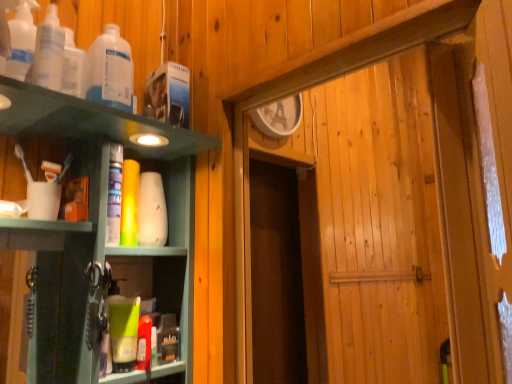
Question: Should I look upward or downward to see green matte tube at lower left, the 1th toiletry from the bottom?

Choices:
 (A) down
 (B) up

Answer: (A)

Question: From the image's perspective, is white matte cup at left on top of translucent plastic bottle at upper left, arranged as the 3th bottle when viewed from the front?

Choices:
 (A) yes
 (B) no

Answer: (B)

Question: Can you confirm if white matte cup at left is smaller than translucent plastic bottle at upper left, the 1th bottle positioned from the back?

Choices:
 (A) no
 (B) yes

Answer: (B)

Question: Can we say white matte cup at left lies outside translucent plastic bottle at upper left, arranged as the 3th bottle when viewed from the front?

Choices:
 (A) no
 (B) yes

Answer: (B)

Question: Does white matte cup at left turn towards translucent plastic bottle at upper left, the 1th bottle positioned from the back?

Choices:
 (A) no
 (B) yes

Answer: (A)

Question: Are white matte cup at left and translucent plastic bottle at upper left, the 1th bottle positioned from the back, located far from each other?

Choices:
 (A) yes
 (B) no

Answer: (B)

Question: From the image's perspective, is white matte cup at left under translucent plastic bottle at upper left, arranged as the 3th bottle when viewed from the front?

Choices:
 (A) yes
 (B) no

Answer: (A)

Question: Can you confirm if green matte tube at lower left, the 1th toiletry from the bottom, is positioned to the left of white matte vase at center, positioned as the second toiletry in front-to-back order?

Choices:
 (A) yes
 (B) no

Answer: (A)

Question: From a real-world perspective, is green matte tube at lower left, marked as the second toiletry in a top-to-bottom arrangement, physically above white matte vase at center, the 1th toiletry from the top?

Choices:
 (A) no
 (B) yes

Answer: (A)

Question: Is green matte tube at lower left, positioned as the second toiletry in back-to-front order, not inside white matte vase at center, which is counted as the 1th toiletry, starting from the back?

Choices:
 (A) yes
 (B) no

Answer: (A)

Question: Would you say white matte vase at center, the 2th toiletry ordered from the bottom, is part of green matte tube at lower left, the 1th toiletry from the bottom,'s contents?

Choices:
 (A) no
 (B) yes

Answer: (A)

Question: Does green matte tube at lower left, marked as the second toiletry in a top-to-bottom arrangement, have a lesser height compared to white matte vase at center, the 1th toiletry from the top?

Choices:
 (A) no
 (B) yes

Answer: (B)

Question: Is green matte tube at lower left, positioned as the second toiletry in back-to-front order, to the right of white matte vase at center, which is counted as the 1th toiletry, starting from the back, from the viewer's perspective?

Choices:
 (A) no
 (B) yes

Answer: (A)

Question: Can you confirm if translucent plastic bottles at upper left, the second bottle from the back, is bigger than white matte cup at left?

Choices:
 (A) yes
 (B) no

Answer: (A)